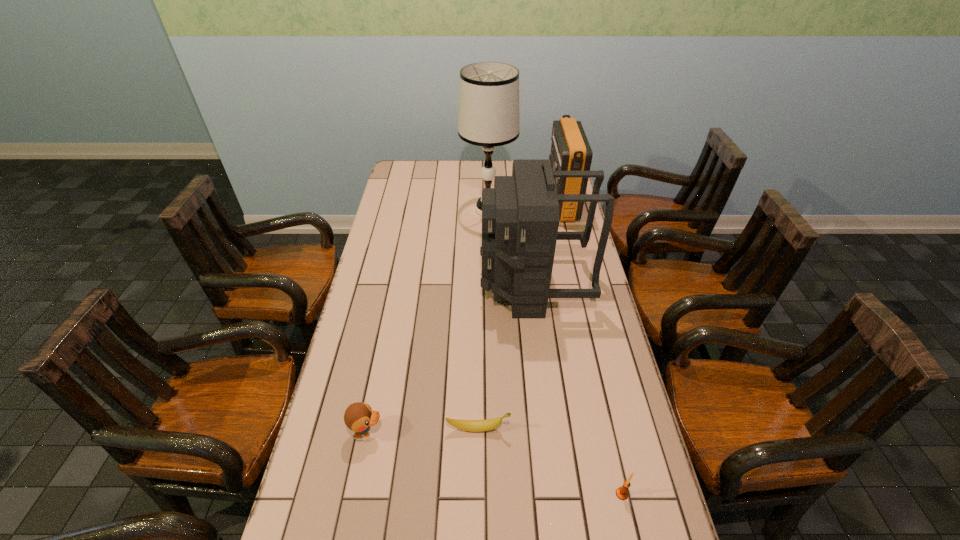
The image size is (960, 540). Identify the location of vacant area between the radio receiver and the nearest object. (591, 349).

You are a GUI agent. You are given a task and a screenshot of the screen. Output one action in this format:
    pyautogui.click(x=<x>, y=<y>)
    Task: Click on the vacant area between the duck and the banana
    This screenshot has height=540, width=960.
    Given the screenshot: What is the action you would take?
    pyautogui.click(x=422, y=430)

Where is `free space between the duck and the nearest object`? The height and width of the screenshot is (540, 960). free space between the duck and the nearest object is located at coordinates (494, 463).

Locate an element on the screen. free space that is in between the candle_holder and the radio receiver is located at coordinates (591, 349).

Select which object is the third closest to the backpack. Please provide its 2D coordinates. Your answer should be formatted as a tuple, i.e. [(x, y)], where the tuple contains the x and y coordinates of a point satisfying the conditions above.

[(467, 425)]

At what (x,y) coordinates should I click in order to perform the action: click on object that stands as the second closest to the fifth shortest object. Please return your answer as a coordinate pair (x, y). The height and width of the screenshot is (540, 960). Looking at the image, I should click on (570, 151).

You are a GUI agent. You are given a task and a screenshot of the screen. Output one action in this format:
    pyautogui.click(x=<x>, y=<y>)
    Task: Click on the free space that satisfies the following two spatial constraints: 1. on the front-facing side of the leftmost object; 2. on the left side of the candle_holder
    
    Given the screenshot: What is the action you would take?
    pyautogui.click(x=355, y=494)

Where is `vacant space that satisfies the following two spatial constraints: 1. on the front compartment of the nearest object; 2. on the right side of the backpack`? The width and height of the screenshot is (960, 540). vacant space that satisfies the following two spatial constraints: 1. on the front compartment of the nearest object; 2. on the right side of the backpack is located at coordinates (560, 494).

Locate an element on the screen. The image size is (960, 540). vacant space that satisfies the following two spatial constraints: 1. on the back side of the nearest object; 2. on the front compartment of the fifth shortest object is located at coordinates (575, 285).

I want to click on blank space that satisfies the following two spatial constraints: 1. on the front-facing side of the nearest object; 2. on the right side of the duck, so click(x=355, y=494).